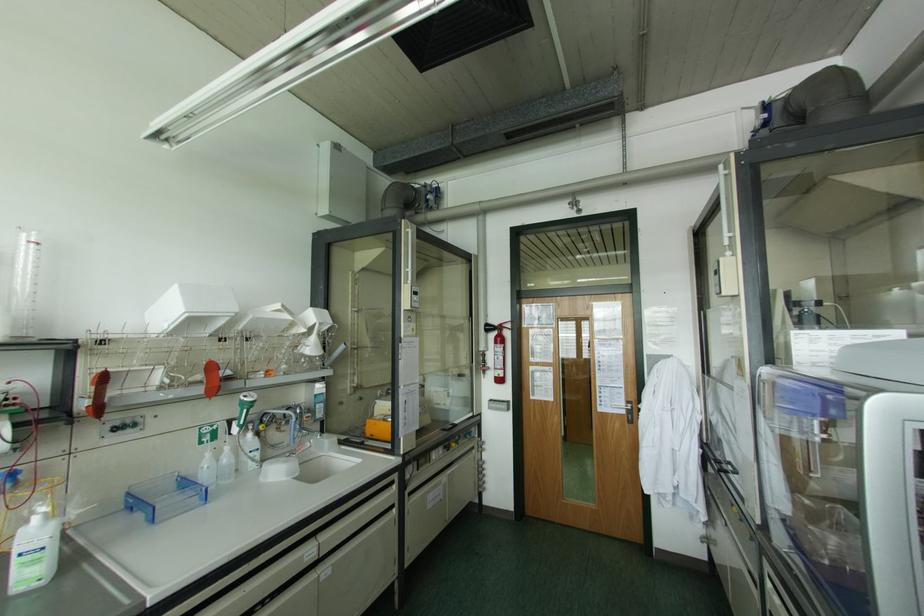
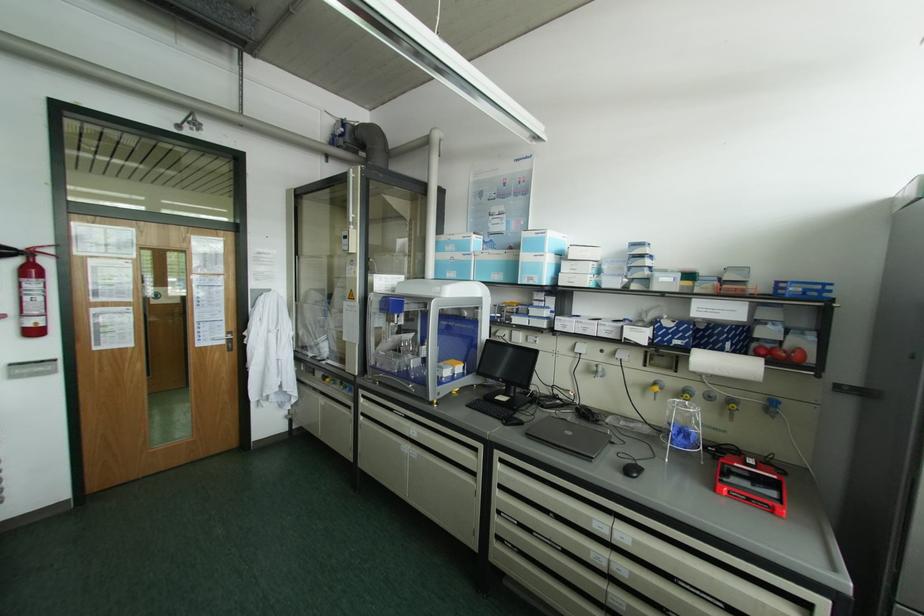
The point at (623, 411) is marked in the first image. Where is the corresponding point in the second image?

(224, 342)